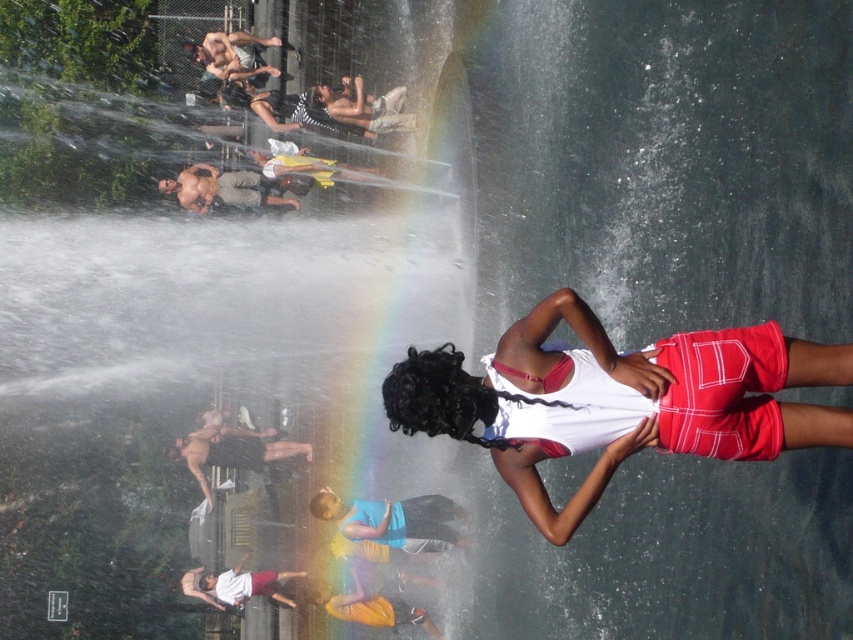
You are a photographer trying to capture a clear shot of both the shiny metallic shorts at upper center and the black fabric shirt at center. Which object should you focus on first to ensure it appears sharp in the photo?

You should focus on the shiny metallic shorts at upper center first because it is closer to you than the black fabric shirt at center, so focusing on it will ensure it stays sharp while the background object may appear slightly blurred.

You are a photographer trying to capture a clear shot of the white fabric shorts at center and the black fabric shirt at center in the image. Since the water jets are spraying widely, which object should you focus on to avoid the water spray first?

The white fabric shorts at center is to the right of black fabric shirt at center. Since the water jets are spraying widely, you should focus on the black fabric shirt at center first as it is positioned to the left and might be less obscured by the rightward spray.